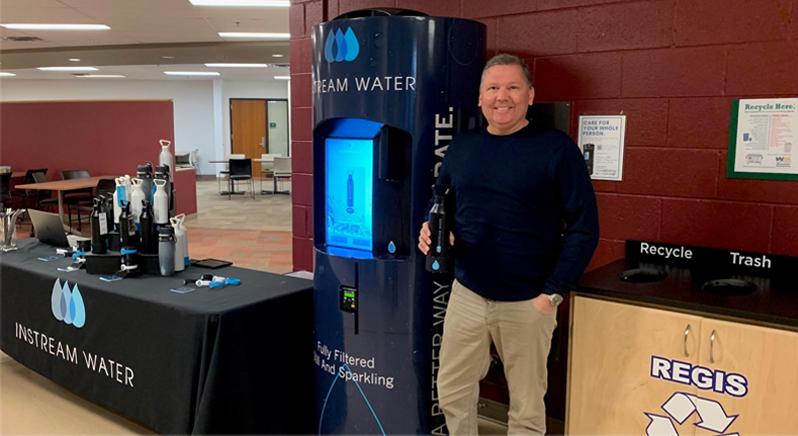
The height and width of the screenshot is (436, 798). In order to click on water machine in this screenshot , I will do `click(397, 110)`.